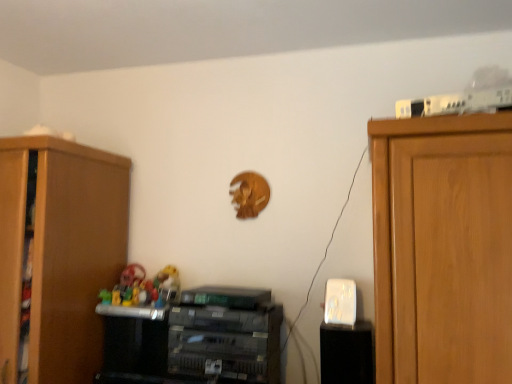
Question: Considering the positions of rubber toys at center and metallic gray printer at center, arranged as the 2th cabinetry when viewed from the right, in the image, is rubber toys at center wider or thinner than metallic gray printer at center, arranged as the 2th cabinetry when viewed from the right,?

Choices:
 (A) wide
 (B) thin

Answer: (B)

Question: In the image, is rubber toys at center positioned in front of or behind metallic gray printer at center, the 2th cabinetry in the left-to-right sequence?

Choices:
 (A) front
 (B) behind

Answer: (B)

Question: Considering the real-world distances, which object is closest to the black plastic speaker at lower right, which is counted as the third cabinetry, starting from the left?

Choices:
 (A) wooden cabinet at left, the first cabinetry in the left-to-right sequence
 (B) metallic gray printer at center, the 2th cabinetry in the left-to-right sequence
 (C) rubber toys at center

Answer: (B)

Question: Which object is positioned closest to the rubber toys at center?

Choices:
 (A) metallic gray printer at center, arranged as the 2th cabinetry when viewed from the right
 (B) black plastic speaker at lower right, which is counted as the third cabinetry, starting from the left
 (C) wooden cabinet at left, the first cabinetry in the left-to-right sequence

Answer: (A)